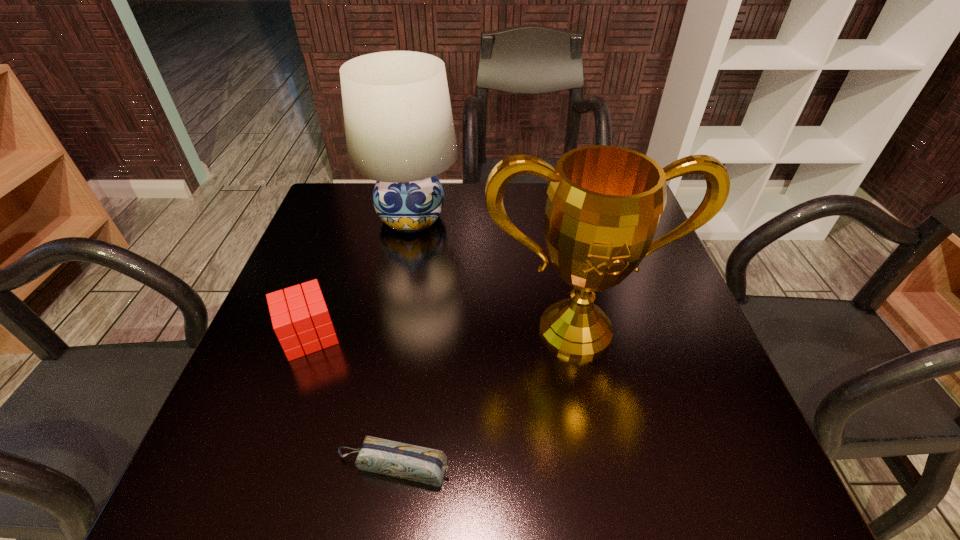
Where is `vacant position at the near right corner of the desktop`? vacant position at the near right corner of the desktop is located at coordinates (671, 448).

At what (x,y) coordinates should I click in order to perform the action: click on vacant space that's between the award and the cube. Please return your answer as a coordinate pair (x, y). The image size is (960, 540). Looking at the image, I should click on (443, 333).

Locate an element on the screen. vacant space that's between the cube and the shortest object is located at coordinates (351, 401).

Locate an element on the screen. This screenshot has width=960, height=540. free space between the award and the second shortest object is located at coordinates (443, 333).

Locate an element on the screen. free space between the award and the second shortest object is located at coordinates (443, 333).

Image resolution: width=960 pixels, height=540 pixels. I want to click on the closest object to the lampshade, so click(x=604, y=203).

The image size is (960, 540). I want to click on object that is the third closest one to the lampshade, so click(x=425, y=465).

Where is `vacant space that satisfies the following two spatial constraints: 1. on the front-facing side of the shortest object; 2. on the right side of the lampshade`? The width and height of the screenshot is (960, 540). vacant space that satisfies the following two spatial constraints: 1. on the front-facing side of the shortest object; 2. on the right side of the lampshade is located at coordinates (363, 467).

Identify the location of vacant area that satisfies the following two spatial constraints: 1. on the front-facing side of the pencil box; 2. on the right side of the lampshade. (363, 467).

Find the location of a particular element. Image resolution: width=960 pixels, height=540 pixels. free point that satisfies the following two spatial constraints: 1. on the front-facing side of the farthest object; 2. on the right side of the nearest object is located at coordinates (363, 467).